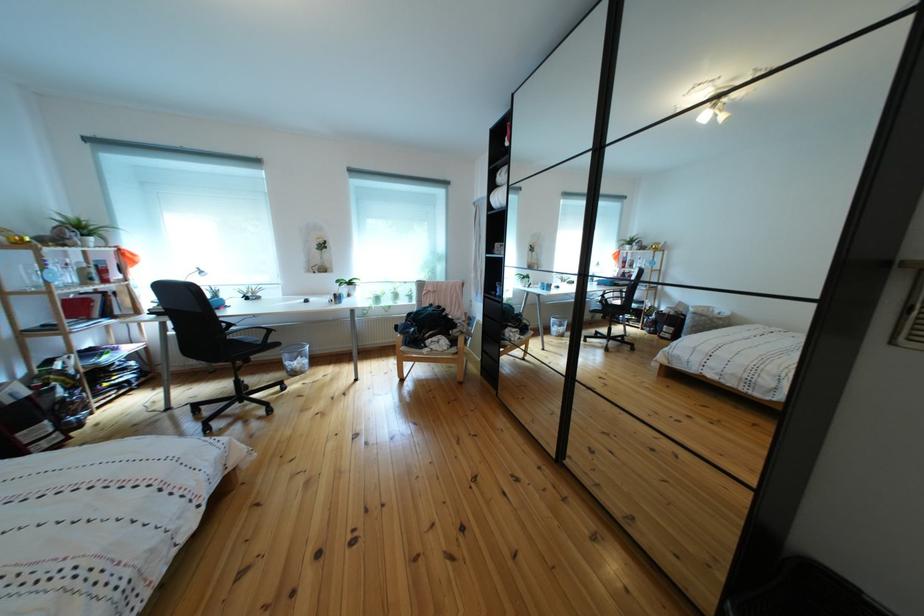
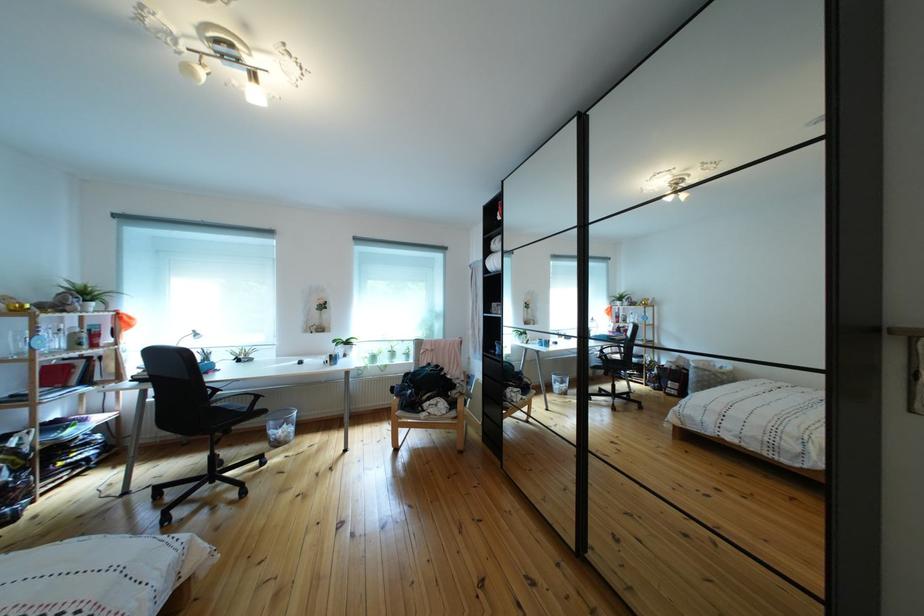
Question: The images are taken continuously from a first-person perspective. In which direction is your viewpoint rotating?

Choices:
 (A) Left
 (B) Right
 (C) Up
 (D) Down

Answer: (C)